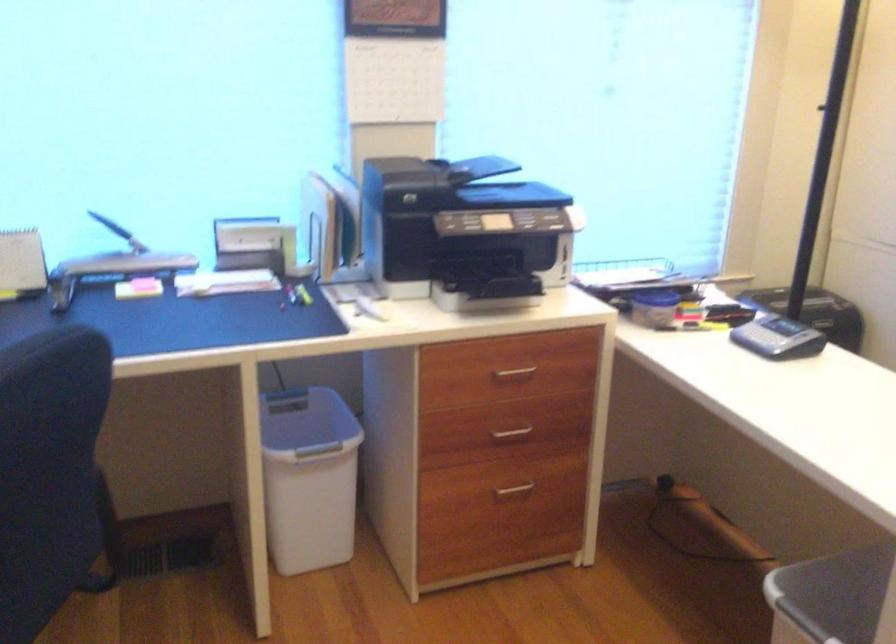
You are a GUI agent. You are given a task and a screenshot of the screen. Output one action in this format:
    pyautogui.click(x=<x>, y=<y>)
    Task: Click on the trash can lid
    The height and width of the screenshot is (644, 896).
    Given the screenshot: What is the action you would take?
    pyautogui.click(x=306, y=424)